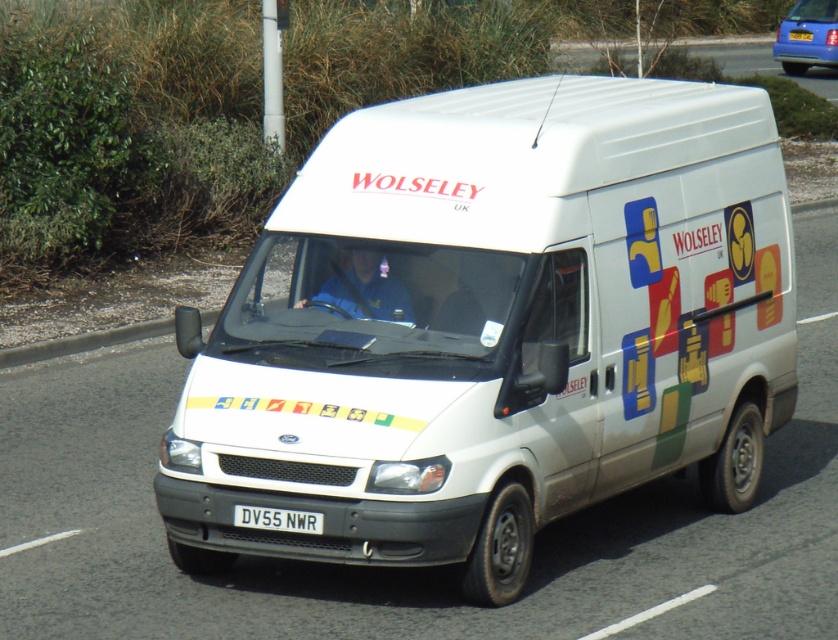
Who is positioned more to the right, white matte van at center or white plastic license plate at center?

white matte van at center is more to the right.

What do you see at coordinates (493, 326) in the screenshot?
I see `white matte van at center` at bounding box center [493, 326].

Locate an element on the screen. The height and width of the screenshot is (640, 838). white matte van at center is located at coordinates (493, 326).

Can you confirm if blue metallic car at upper right is positioned above white plastic license plate at center?

Yes, blue metallic car at upper right is above white plastic license plate at center.

Can you confirm if blue metallic car at upper right is bigger than white plastic license plate at center?

Indeed, blue metallic car at upper right has a larger size compared to white plastic license plate at center.

Identify the location of blue metallic car at upper right. Image resolution: width=838 pixels, height=640 pixels. (807, 36).

Who is lower down, white matte van at center or blue metallic car at upper right?

white matte van at center

Which is more to the left, white matte van at center or blue metallic car at upper right?

white matte van at center

Is point (490, 179) farther from camera compared to point (795, 67)?

No, (490, 179) is in front of (795, 67).

Find the location of a particular element. white matte van at center is located at coordinates (493, 326).